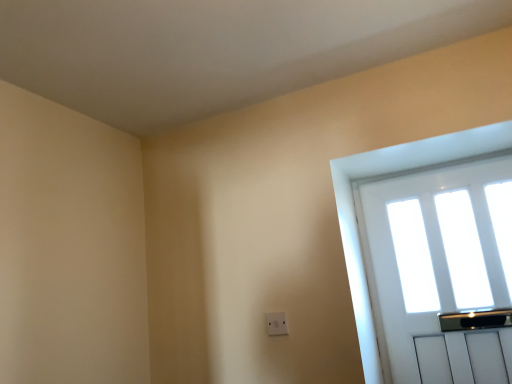
What do you see at coordinates (276, 324) in the screenshot? This screenshot has width=512, height=384. I see `white plastic electric outlet at center` at bounding box center [276, 324].

You are a GUI agent. You are given a task and a screenshot of the screen. Output one action in this format:
    pyautogui.click(x=<x>, y=<y>)
    Task: Click on the white plastic electric outlet at center
    This screenshot has height=384, width=512.
    Given the screenshot: What is the action you would take?
    pyautogui.click(x=276, y=324)

Measure the distance between point (283, 313) and camera.

Point (283, 313) and camera are 1.69 meters apart from each other.

Image resolution: width=512 pixels, height=384 pixels. I want to click on white wooden door at upper right, so click(x=439, y=270).

This screenshot has height=384, width=512. What do you see at coordinates (439, 270) in the screenshot? I see `white wooden door at upper right` at bounding box center [439, 270].

You are a GUI agent. You are given a task and a screenshot of the screen. Output one action in this format:
    pyautogui.click(x=<x>, y=<y>)
    Task: Click on the white plastic electric outlet at center
    The width and height of the screenshot is (512, 384).
    Given the screenshot: What is the action you would take?
    pyautogui.click(x=276, y=324)

In the image, is white wooden door at upper right on the left side or the right side of white plastic electric outlet at center?

In the image, white wooden door at upper right appears on the right side of white plastic electric outlet at center.

In the image, is white wooden door at upper right positioned in front of or behind white plastic electric outlet at center?

white wooden door at upper right is positioned closer to the viewer than white plastic electric outlet at center.

Which is nearer, [424,331] or [266,324]?

The point [266,324] is closer to the camera.

From the image's perspective, is white wooden door at upper right located above white plastic electric outlet at center?

Yes, from the image's perspective, white wooden door at upper right is on top of white plastic electric outlet at center.

From a real-world perspective, is white wooden door at upper right over white plastic electric outlet at center?

Correct, in the physical world, white wooden door at upper right is higher than white plastic electric outlet at center.

Can you confirm if white wooden door at upper right is thinner than white plastic electric outlet at center?

In fact, white wooden door at upper right might be wider than white plastic electric outlet at center.

Who is shorter, white wooden door at upper right or white plastic electric outlet at center?

Standing shorter between the two is white plastic electric outlet at center.

Is white wooden door at upper right bigger or smaller than white plastic electric outlet at center?

Considering their sizes, white wooden door at upper right takes up more space than white plastic electric outlet at center.

Would you say white wooden door at upper right is outside white plastic electric outlet at center?

white wooden door at upper right lies outside white plastic electric outlet at center's area.

Is white wooden door at upper right not close to white plastic electric outlet at center?

That's not correct — white wooden door at upper right is a little close to white plastic electric outlet at center.

Based on the photo, is white wooden door at upper right turned away from white plastic electric outlet at center?

No.

In the scene shown: What's the angular difference between white wooden door at upper right and white plastic electric outlet at center's facing directions?

They differ by 0.105 degrees in their facing directions.

Find the location of a particular element. Image resolution: width=512 pixels, height=384 pixels. window that appears on the right of white plastic electric outlet at center is located at coordinates (439, 270).

Considering the relative positions of white plastic electric outlet at center and white wooden door at upper right in the image provided, is white plastic electric outlet at center to the right of white wooden door at upper right from the viewer's perspective?

No, white plastic electric outlet at center is not to the right of white wooden door at upper right.

Who is more distant, white plastic electric outlet at center or white wooden door at upper right?

white plastic electric outlet at center is further away from the camera.

Is point (266, 313) closer to viewer compared to point (481, 188)?

Yes.

From the image's perspective, relative to white wooden door at upper right, is white plastic electric outlet at center above or below?

white plastic electric outlet at center is below white wooden door at upper right.

From a real-world perspective, which object rests below the other?

white plastic electric outlet at center is physically lower.

Can you confirm if white plastic electric outlet at center is wider than white wooden door at upper right?

In fact, white plastic electric outlet at center might be narrower than white wooden door at upper right.

Considering the relative sizes of white plastic electric outlet at center and white wooden door at upper right in the image provided, is white plastic electric outlet at center taller than white wooden door at upper right?

No, white plastic electric outlet at center is not taller than white wooden door at upper right.

Between white plastic electric outlet at center and white wooden door at upper right, which one has smaller size?

white plastic electric outlet at center is smaller.

Looking at this image, is white plastic electric outlet at center located outside white wooden door at upper right?

That's correct, white plastic electric outlet at center is outside of white wooden door at upper right.

Is white plastic electric outlet at center placed right next to white wooden door at upper right?

white plastic electric outlet at center and white wooden door at upper right are clearly separated.

Is white plastic electric outlet at center turned away from white wooden door at upper right?

No.

Measure the distance between white plastic electric outlet at center and white wooden door at upper right.

white plastic electric outlet at center is 29.25 inches away from white wooden door at upper right.

What are the coordinates of `electric outlet on the left side of white wooden door at upper right` in the screenshot? It's located at (276, 324).

Find the location of `electric outlet behind the white wooden door at upper right`. electric outlet behind the white wooden door at upper right is located at coordinates (276, 324).

Identify the location of electric outlet on the left of white wooden door at upper right. (276, 324).